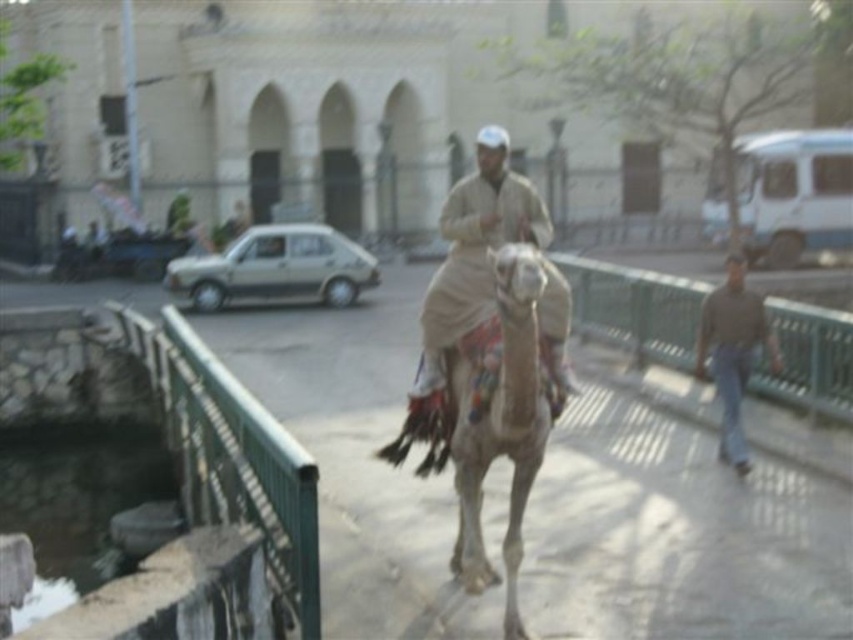
Question: Is white textured camel at center in front of brown cotton shirt at right?

Choices:
 (A) yes
 (B) no

Answer: (A)

Question: Considering the relative positions of beige fabric outfit at center and brown cotton shirt at right in the image provided, where is beige fabric outfit at center located with respect to brown cotton shirt at right?

Choices:
 (A) above
 (B) below

Answer: (A)

Question: Which point is closer to the camera?

Choices:
 (A) (759, 336)
 (B) (555, 304)

Answer: (B)

Question: Which is farther from the white textured camel at center?

Choices:
 (A) brown cotton shirt at right
 (B) beige fabric outfit at center

Answer: (A)

Question: Does green metal railing at lower left come in front of brown cotton shirt at right?

Choices:
 (A) no
 (B) yes

Answer: (B)

Question: Which point is closer to the camera?

Choices:
 (A) (257, 444)
 (B) (489, 220)
 (C) (547, 403)
 (D) (708, 320)

Answer: (C)